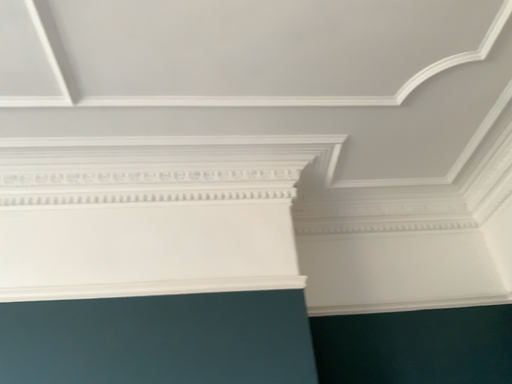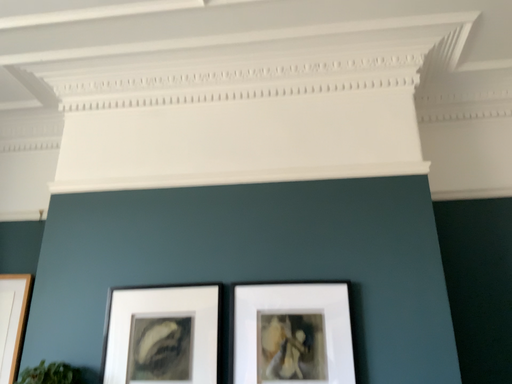
Question: Which way did the camera rotate in the video?

Choices:
 (A) rotated upward
 (B) rotated downward

Answer: (B)